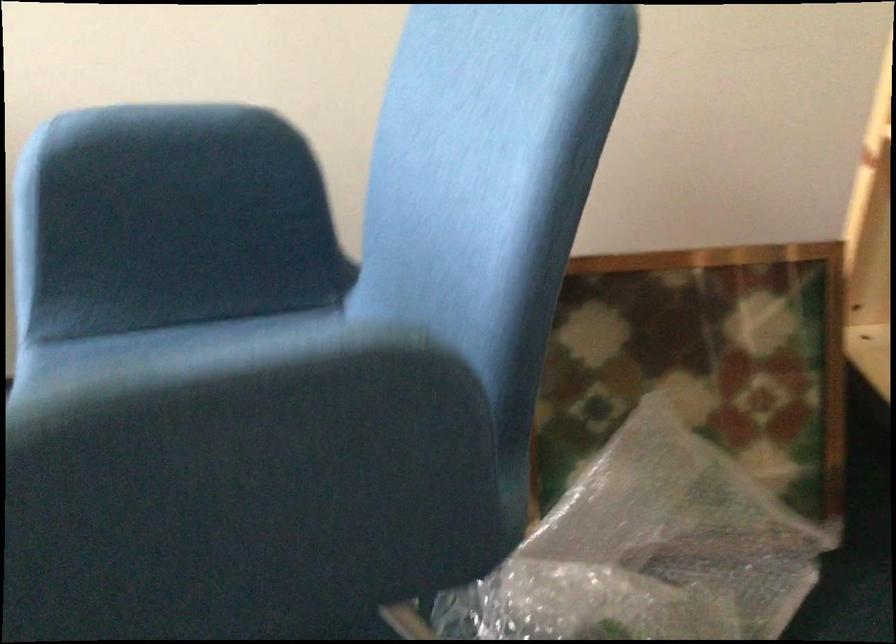
This screenshot has height=644, width=896. What do you see at coordinates (170, 337) in the screenshot? I see `the blue chair sitting surface` at bounding box center [170, 337].